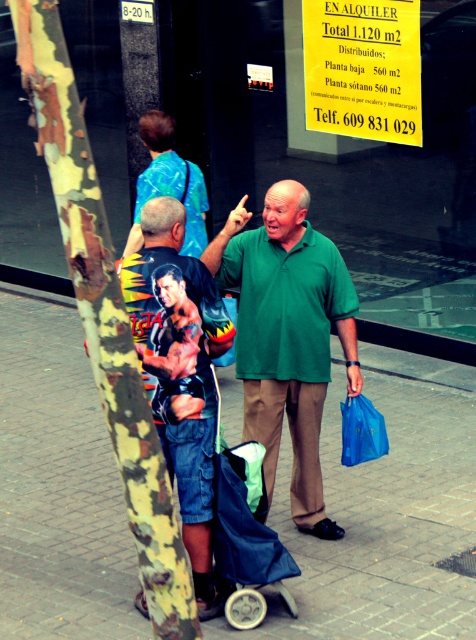
Question: Is camouflage fabric shirt at center thinner than yellow paper sign at upper center?

Choices:
 (A) no
 (B) yes

Answer: (B)

Question: Is brick pavement at center thinner than yellow paper sign at upper center?

Choices:
 (A) no
 (B) yes

Answer: (A)

Question: Which point is closer to the camera taking this photo?

Choices:
 (A) (169, 122)
 (B) (188, 412)
 (C) (353, 465)
 (D) (68, 188)

Answer: (D)

Question: Observing the image, what is the correct spatial positioning of camouflage fabric shirt at center in reference to blue t-shirt at upper left?

Choices:
 (A) below
 (B) above

Answer: (A)

Question: Among these objects, which one is farthest from the camera?

Choices:
 (A) camouflage fabric shirt at center
 (B) green matte shirt at center

Answer: (B)

Question: Which point is closer to the camera?

Choices:
 (A) (392, 461)
 (B) (212, 465)
 (C) (355, 400)
 (D) (283, 264)

Answer: (B)